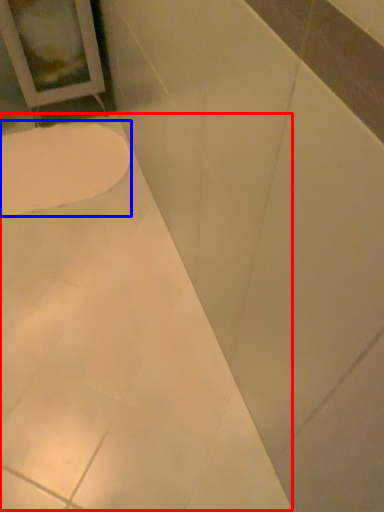
Question: Which point is closer to the camera, bath (highlighted by a red box) or toilet (highlighted by a blue box)?

Choices:
 (A) bath
 (B) toilet

Answer: (A)